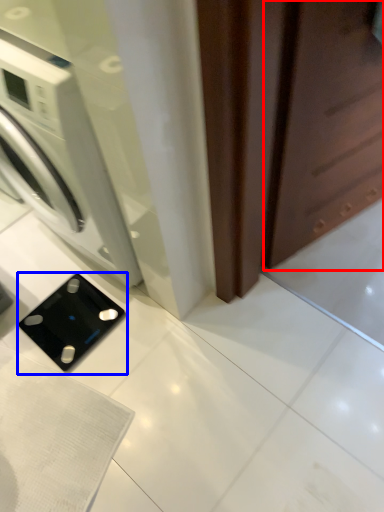
Question: Which of the following is the farthest to the observer, screen door (highlighted by a red box) or appliance (highlighted by a blue box)?

Choices:
 (A) screen door
 (B) appliance

Answer: (B)